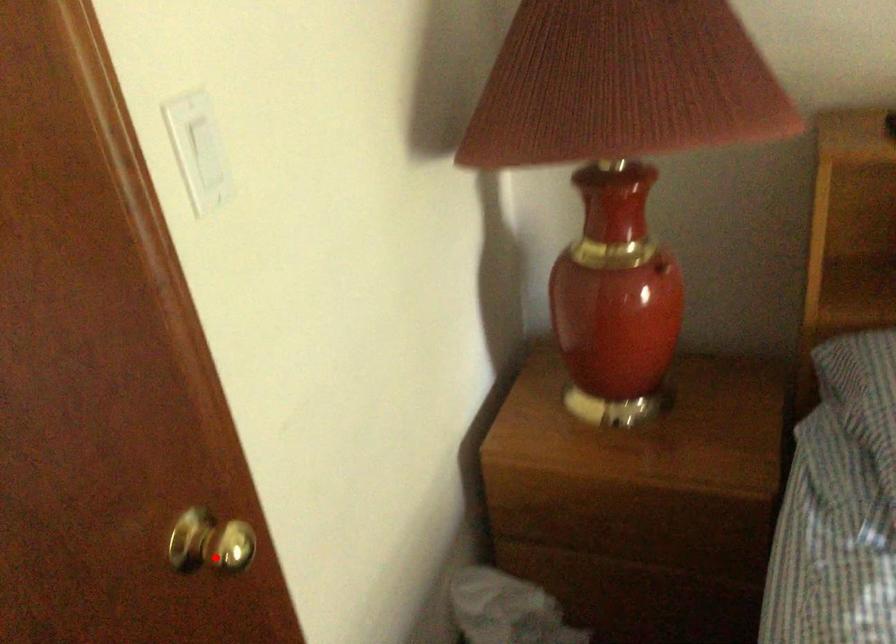
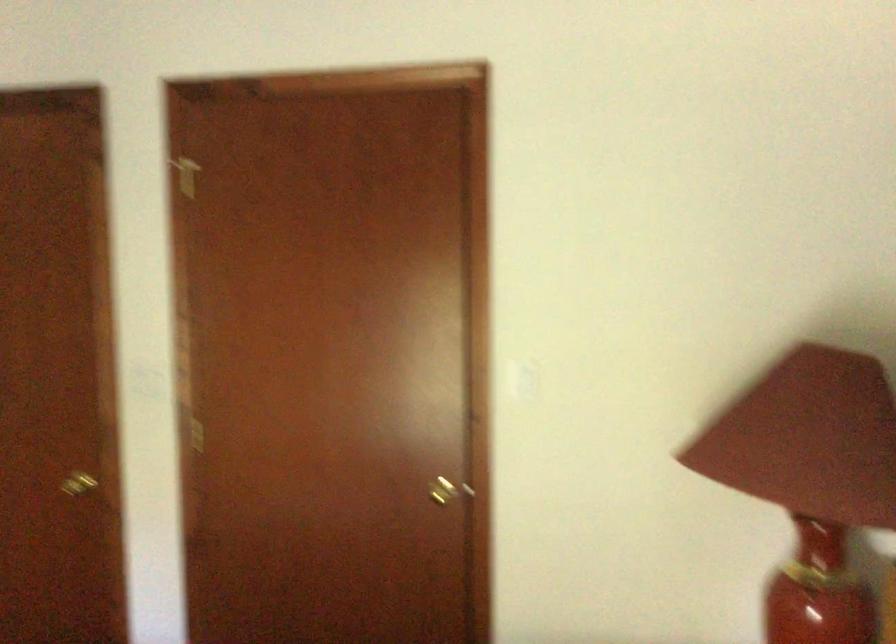
The point at the highlighted location is marked in the first image. Where is the corresponding point in the second image?

(446, 489)